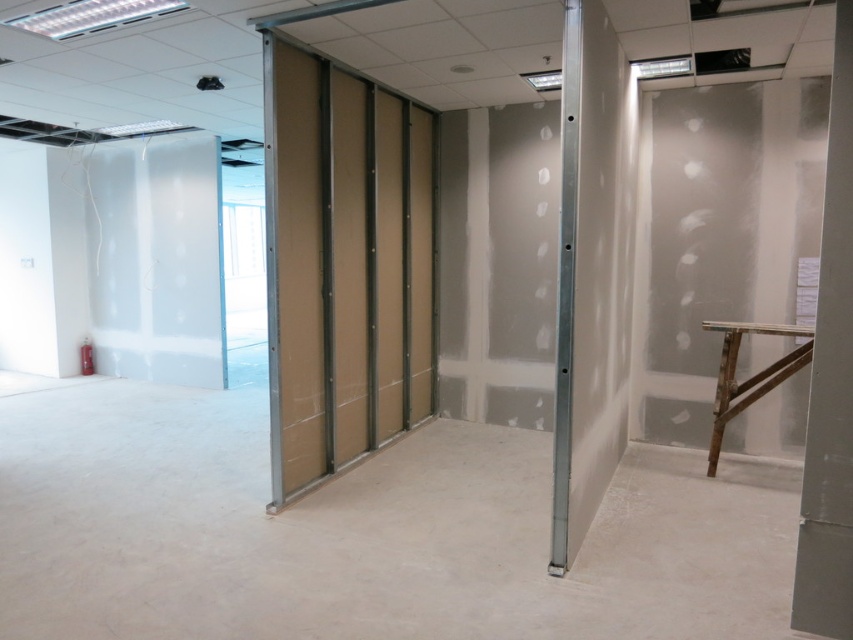
Question: Does metallic silver pillar at center appear under white smooth pillar at right?

Choices:
 (A) no
 (B) yes

Answer: (A)

Question: Which object is closer to the camera taking this photo?

Choices:
 (A) white smooth pillar at right
 (B) metallic silver pillar at center

Answer: (A)

Question: Does metallic silver pillar at center come behind white smooth pillar at right?

Choices:
 (A) no
 (B) yes

Answer: (B)

Question: Among these objects, which one is nearest to the camera?

Choices:
 (A) white smooth pillar at right
 (B) metallic silver pillar at center

Answer: (A)

Question: Does metallic silver pillar at center have a lesser width compared to white smooth pillar at right?

Choices:
 (A) no
 (B) yes

Answer: (A)